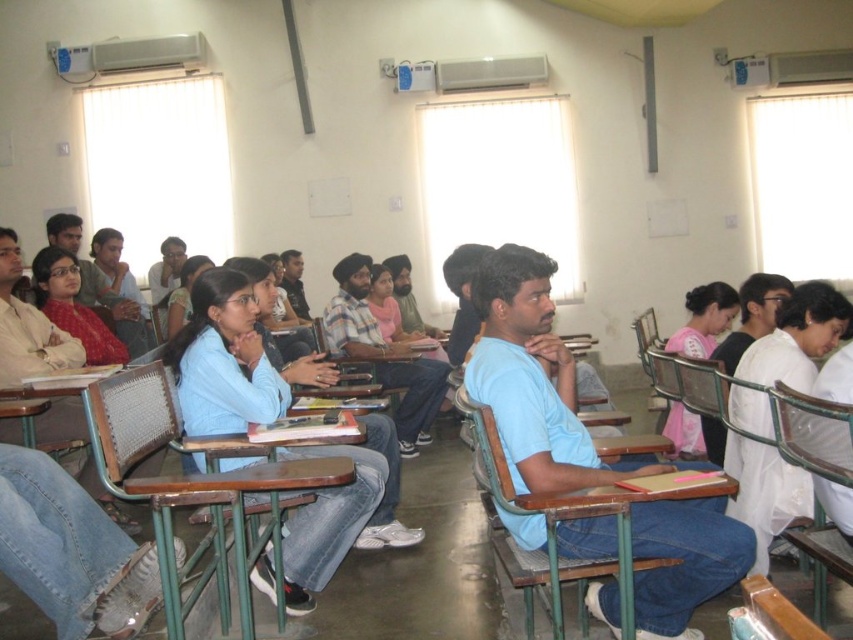
Question: Which object is farther from the camera taking this photo?

Choices:
 (A) wooden at center
 (B) matte blue shirt at center

Answer: (B)

Question: Is wooden at center to the right of matte blue shirt at center from the viewer's perspective?

Choices:
 (A) no
 (B) yes

Answer: (B)

Question: Is wooden at center further to the viewer compared to matte blue shirt at center?

Choices:
 (A) no
 (B) yes

Answer: (A)

Question: In this image, where is wooden at center located relative to matte blue shirt at center?

Choices:
 (A) above
 (B) below

Answer: (B)